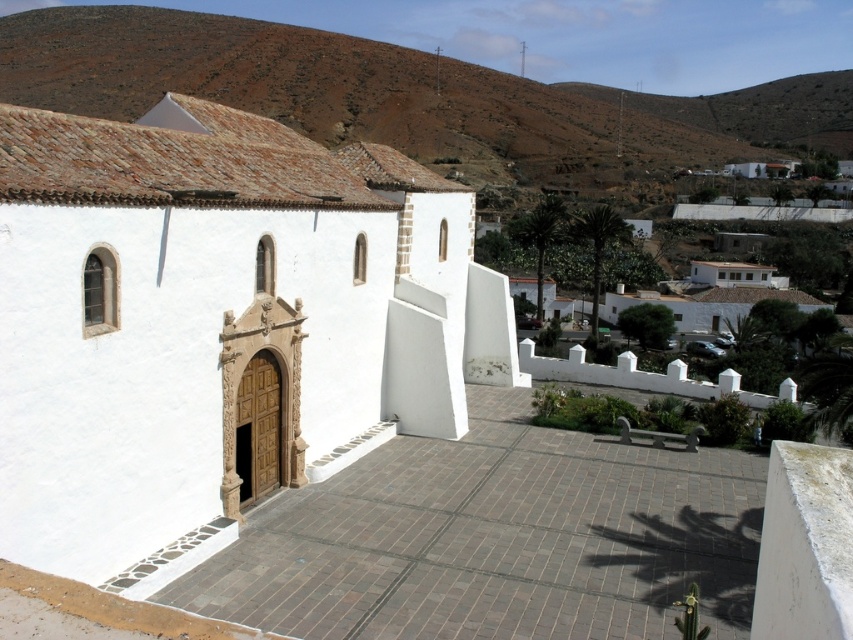
Question: Among these objects, which one is farthest from the camera?

Choices:
 (A) brown clay hillside at upper center
 (B) white matte church at center

Answer: (A)

Question: Which of the following is the closest to the observer?

Choices:
 (A) white matte church at center
 (B) brown clay hillside at upper center

Answer: (A)

Question: Is white matte church at center bigger than brown clay hillside at upper center?

Choices:
 (A) yes
 (B) no

Answer: (B)

Question: Among these points, which one is nearest to the camera?

Choices:
 (A) (219, 100)
 (B) (4, 422)

Answer: (B)

Question: From the image, what is the correct spatial relationship of white matte church at center in relation to brown clay hillside at upper center?

Choices:
 (A) right
 (B) left

Answer: (A)

Question: Can you confirm if white matte church at center is positioned below brown clay hillside at upper center?

Choices:
 (A) no
 (B) yes

Answer: (B)